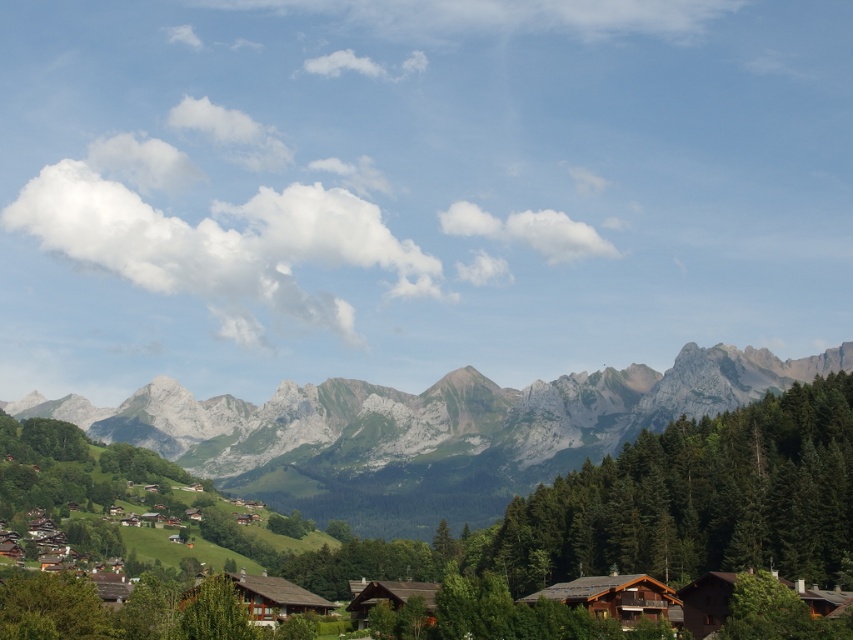
You are standing in the mountain village and want to take a photo of the brown wooden house at lower center without the green textured tree at center blocking the view. What should you do?

Move to a position where the green textured tree at center is no longer between you and the brown wooden house at lower center. Since the green textured tree at center is positioned over the brown wooden house at lower center, moving to a lower or higher angle might allow you to capture the house without the tree obstructing the view.

You are a hiker standing at the camera position in this mountain landscape. You want to take a photo of the green leafy tree at center. If your camera has a maximum focus range of 500 feet, will you be able to focus on the tree?

The green leafy tree at center is 514.82 feet from the camera, which exceeds the camera maximum focus range of 500 feet. Therefore, the camera cannot focus on the tree.

You are standing in the village and see the green leafy tree at center and the brown wooden hut at center. Which one is positioned to the left?

The green leafy tree at center is positioned to the left of the brown wooden hut at center.